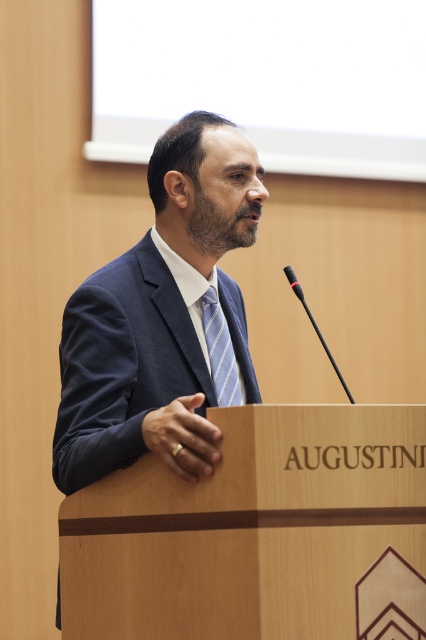
Question: Is dark brown textured beard at center positioned at the back of black plastic microphone at center?

Choices:
 (A) yes
 (B) no

Answer: (A)

Question: Observing the image, what is the correct spatial positioning of dark blue suit at center in reference to dark brown textured beard at center?

Choices:
 (A) below
 (B) above

Answer: (A)

Question: Which point is closer to the camera?

Choices:
 (A) striped fabric tie at center
 (B) black plastic microphone at center

Answer: (B)

Question: Considering the real-world distances, which object is farthest from the dark brown textured beard at center?

Choices:
 (A) black matte microphone at center
 (B) black plastic microphone at center
 (C) dark blue suit at center

Answer: (C)

Question: Which object appears farthest from the camera in this image?

Choices:
 (A) striped fabric tie at center
 (B) black matte microphone at center
 (C) dark brown textured beard at center

Answer: (C)

Question: Is dark brown textured beard at center smaller than striped fabric tie at center?

Choices:
 (A) yes
 (B) no

Answer: (A)